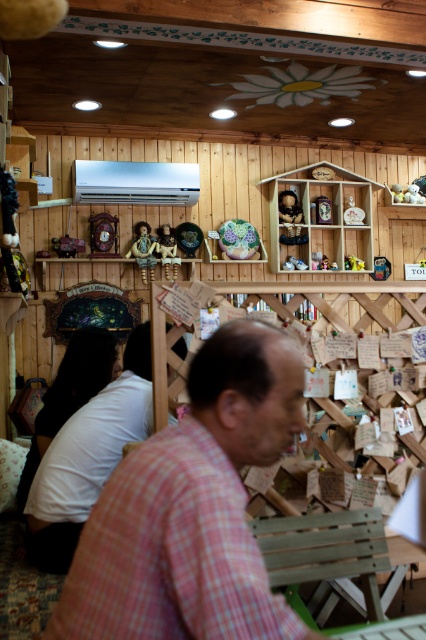
Question: Can you confirm if matte brown doll at upper center is thinner than matte ceramic figurine at upper center?

Choices:
 (A) no
 (B) yes

Answer: (A)

Question: Can you confirm if white matte shirt at left is wider than matte plastic figurine at upper center?

Choices:
 (A) no
 (B) yes

Answer: (B)

Question: From the image, what is the correct spatial relationship of white matte shirt at left in relation to matte brown doll at upper center?

Choices:
 (A) above
 (B) below

Answer: (B)

Question: Which object is farther from the camera taking this photo?

Choices:
 (A) white matte shirt at left
 (B) matte plastic figurine at upper center

Answer: (B)

Question: Which object is the closest to the white matte shirt at left?

Choices:
 (A) wooden shelf at upper center
 (B) fluffy plush bear at upper center
 (C) matte ceramic figurine at upper center
 (D) pink checkered shirt at center

Answer: (D)

Question: Which is farther from the fluffy plush bear at upper center?

Choices:
 (A) white matte shirt at left
 (B) matte brown doll at upper center
 (C) pink checkered shirt at center

Answer: (C)